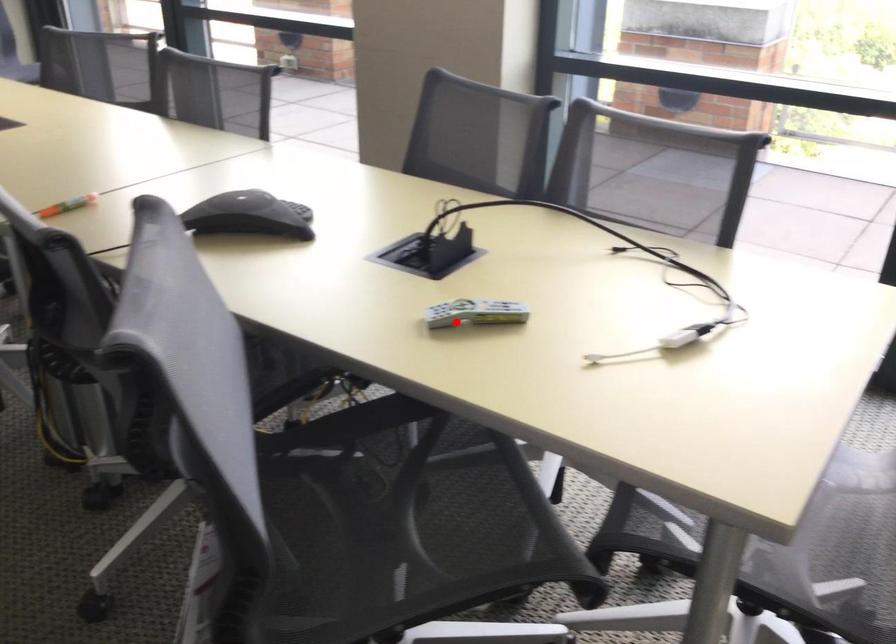
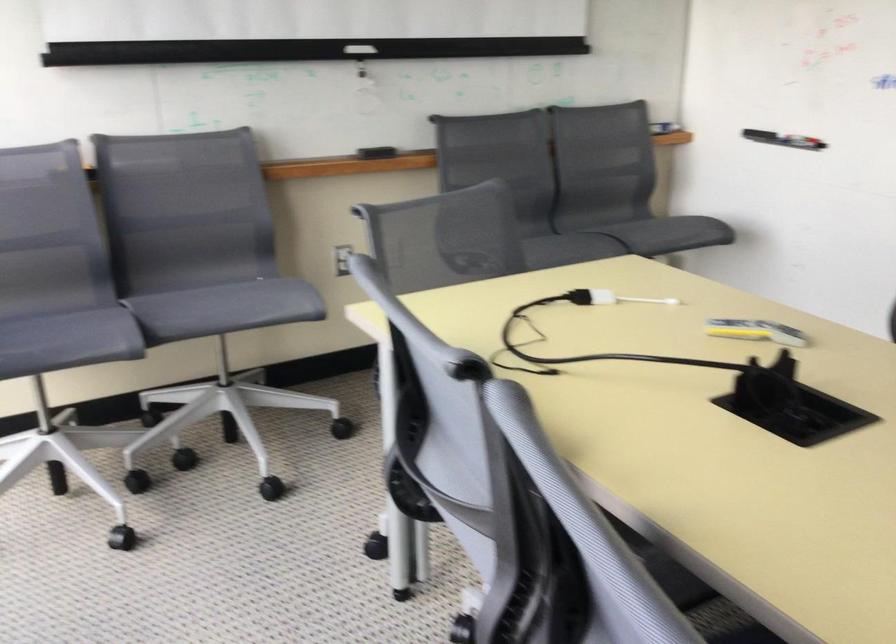
Question: I am providing you with two images of the same scene from different viewpoints. A red point is shown in image1. For the corresponding object point in image2, is it positioned nearer or farther from the camera?

Choices:
 (A) Nearer
 (B) Farther

Answer: (B)